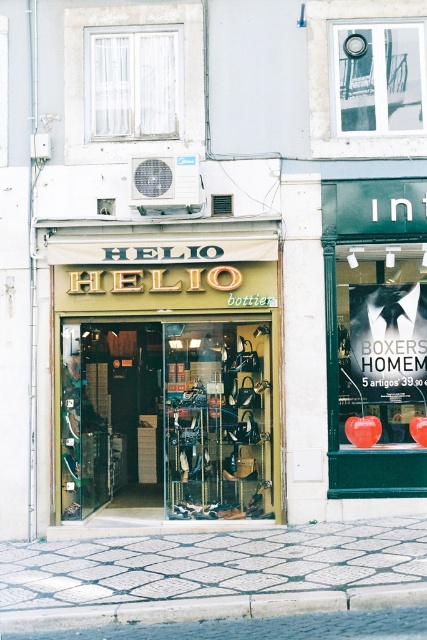
You are standing at the intersection facing the two storefronts. There is a matte gold signboard at center located at point (170,381). Which storefront does it belong to, the left one with the green metal doors or the right one with the dark green sign?

The matte gold signboard at center located at point (170,381) belongs to the left storefront with the green metal doors because it is positioned at the center, which is closer to the left side than the right side in the image.

You are a delivery person trying to find the entrance to the shoe store. You see the matte black poster at center right and the concrete at lower center. Which object is closer to the entrance?

The concrete at lower center is closer to the entrance because the matte black poster at center right is larger in size than it, implying it is further away.

You are standing at the entrance of the HELIO bottier store. You want to place a new poster that is 0.3 meters wide at the exact center of the storefront. However, there is already a matte black poster at center right. Where should you place the new poster so it doesn

The matte black poster at center right is located at coordinates point (382, 344). To place the new poster at the exact center without overlapping, you should position it at the center point of the storefront, which is likely at coordinates (213, 320). However, since the existing poster is at (382, 344), you need to adjust the new poster to a different central position that avoids this spot while maintaining the desired central placement. Consider calculating the midpoint between the storefront edges and